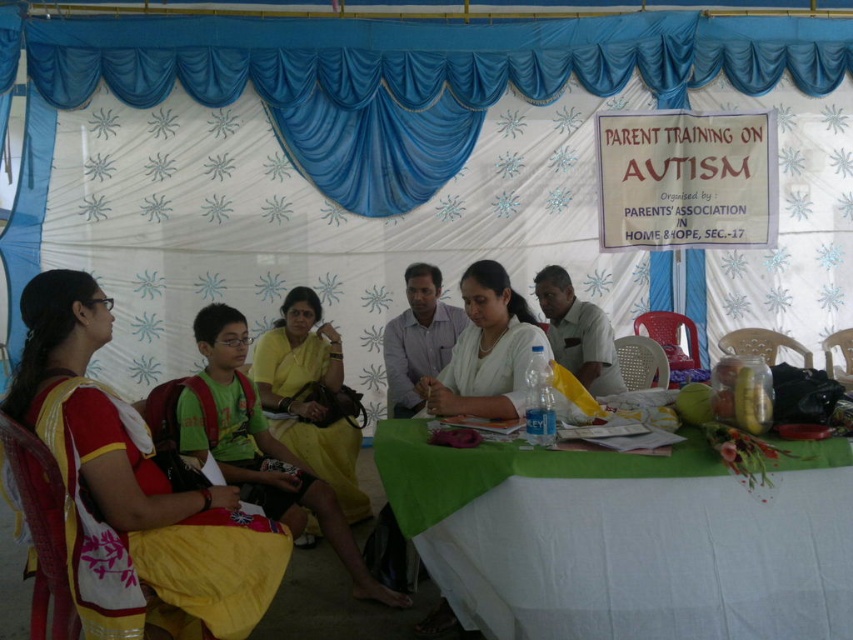
Looking at this image, is green cloth table at center wider than light brown shirt at center?

Yes, green cloth table at center is wider than light brown shirt at center.

Is green cloth table at center closer to the viewer compared to light brown shirt at center?

Yes, it is in front of light brown shirt at center.

Locate an element on the screen. The height and width of the screenshot is (640, 853). green cloth table at center is located at coordinates (505, 470).

Is yellow cotton saree at left further to the viewer compared to light brown shirt at center?

No.

Is yellow cotton saree at left smaller than light brown shirt at center?

No, yellow cotton saree at left is not smaller than light brown shirt at center.

Find the location of a particular element. The width and height of the screenshot is (853, 640). yellow cotton saree at left is located at coordinates tap(132, 490).

Who is shorter, yellow cotton saree at left or green cloth table at center?

Standing shorter between the two is green cloth table at center.

Is point (248, 576) positioned before point (442, 524)?

Yes, it is.

Is point (39, 371) in front of point (404, 422)?

Yes, point (39, 371) is in front of point (404, 422).

This screenshot has height=640, width=853. I want to click on yellow cotton saree at left, so click(132, 490).